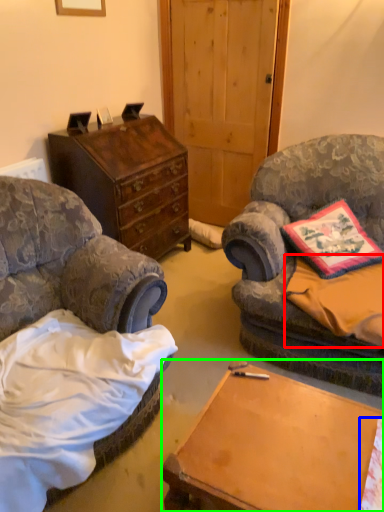
Question: Which object is the farthest from sheet (highlighted by a red box)? Choose among these: sheet (highlighted by a blue box) or desk (highlighted by a green box).

Choices:
 (A) sheet
 (B) desk

Answer: (A)